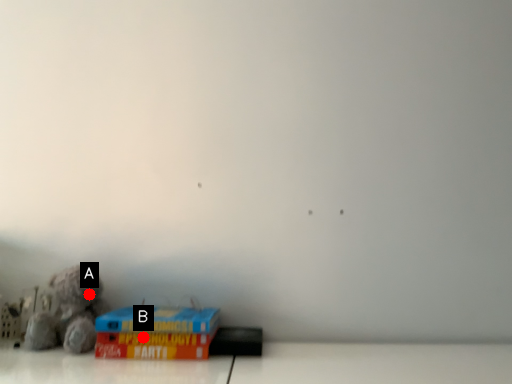
Question: Two points are circled on the image, labeled by A and B beside each circle. Among these points, which one is nearest to the camera?

Choices:
 (A) A is closer
 (B) B is closer

Answer: (B)